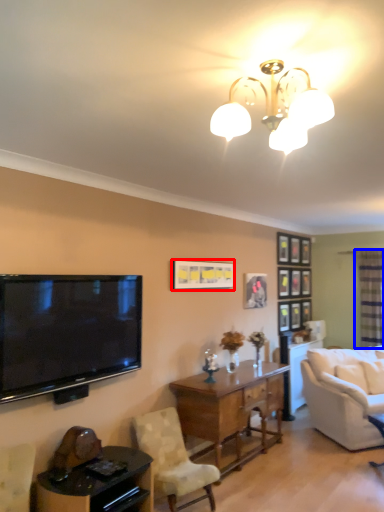
Question: Among these objects, which one is nearest to the camera, picture frame (highlighted by a red box) or glass door (highlighted by a blue box)?

Choices:
 (A) picture frame
 (B) glass door

Answer: (A)